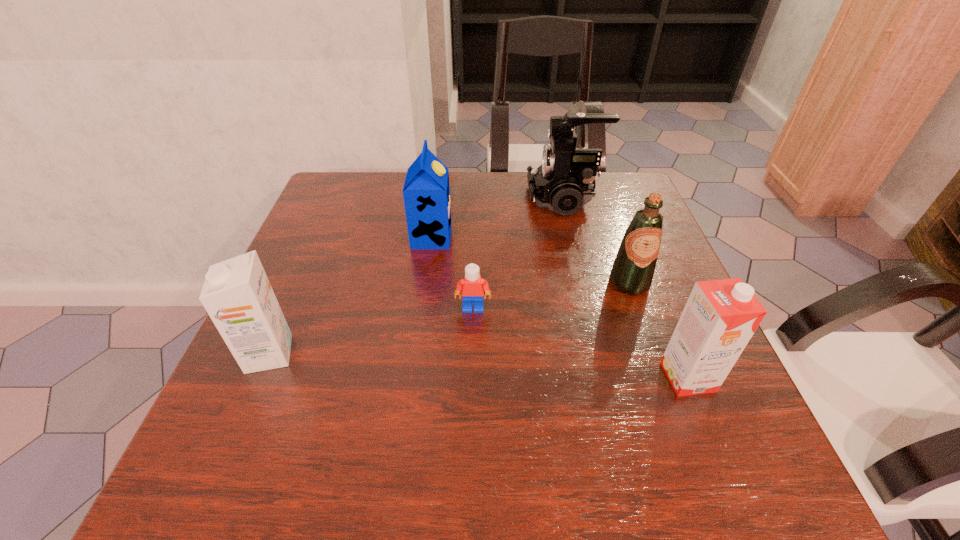
Locate an element on the screen. vacant area situated on the lens mount of the farthest object is located at coordinates click(x=494, y=199).

Find the location of a particular element. Image resolution: width=960 pixels, height=540 pixels. vacant space situated 0.100m with the cap open on the farthest carton is located at coordinates (492, 237).

At what (x,y) coordinates should I click in order to perform the action: click on free space located 0.060m on the front-facing side of the third farthest object. Please return your answer as a coordinate pair (x, y). Looking at the image, I should click on (642, 319).

You are a GUI agent. You are given a task and a screenshot of the screen. Output one action in this format:
    pyautogui.click(x=<x>, y=<y>)
    Task: Click on the blank area located on the back of the rightmost carton
    Image resolution: width=960 pixels, height=540 pixels.
    Given the screenshot: What is the action you would take?
    pyautogui.click(x=660, y=310)

Find the location of a particular element. vacant space located 0.070m on the front of the leftmost object is located at coordinates (245, 410).

This screenshot has width=960, height=540. I want to click on vacant position located on the face of the third object from left to right, so click(x=471, y=403).

Identify the location of object situated at the far edge. [564, 182].

Locate an element on the screen. object present at the left edge is located at coordinates (237, 295).

Locate an element on the screen. Image resolution: width=960 pixels, height=540 pixels. camcorder that is at the right edge is located at coordinates (564, 182).

The width and height of the screenshot is (960, 540). Identify the location of olive oil present at the right edge. (632, 272).